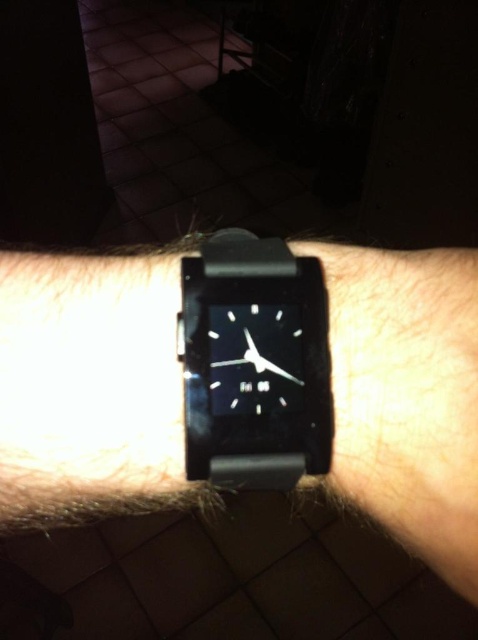
Can you confirm if black matte watch at center is bigger than black rubber watch at center?

Indeed, black matte watch at center has a larger size compared to black rubber watch at center.

The width and height of the screenshot is (478, 640). What are the coordinates of `black matte watch at center` in the screenshot? It's located at (89, 387).